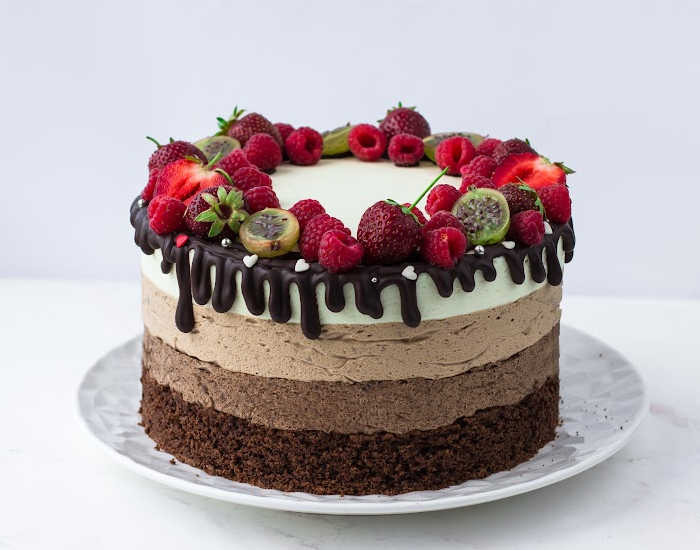
Locate an element on the screen. This screenshot has width=700, height=550. light is located at coordinates (230, 379).